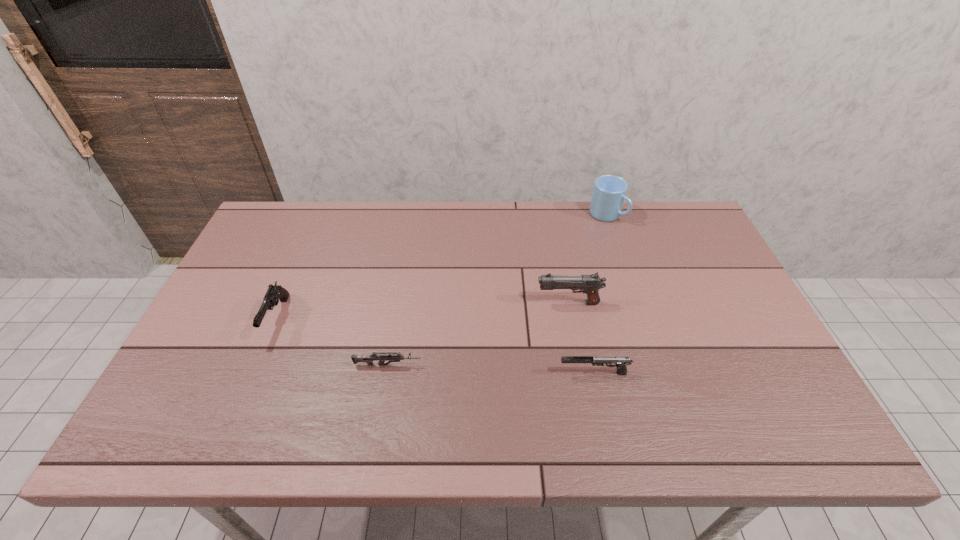
What are the coordinates of `free location located 0.060m in the direction the tallest gun is aimed` in the screenshot? It's located at (515, 303).

Where is `vacant space situated in the direction the tallest gun is aimed`? The height and width of the screenshot is (540, 960). vacant space situated in the direction the tallest gun is aimed is located at coordinates (402, 303).

Where is `blank space located in the direction the tallest gun is aimed`? This screenshot has width=960, height=540. blank space located in the direction the tallest gun is aimed is located at coordinates (489, 303).

This screenshot has height=540, width=960. What are the coordinates of `vacant point located at the end of the barrel of the leftmost object` in the screenshot? It's located at (249, 386).

Where is `free space located at the muzzle end of the fourth tallest object`? The width and height of the screenshot is (960, 540). free space located at the muzzle end of the fourth tallest object is located at coordinates (460, 373).

Locate an element on the screen. The height and width of the screenshot is (540, 960). blank space located at the muzzle end of the fourth tallest object is located at coordinates (401, 373).

Identify the location of free space located at the muzzle end of the fourth tallest object. The width and height of the screenshot is (960, 540). (521, 373).

The height and width of the screenshot is (540, 960). Find the location of `free space located aimed along the barrel of the shortest gun`. free space located aimed along the barrel of the shortest gun is located at coordinates (568, 365).

The height and width of the screenshot is (540, 960). In order to click on object that is at the far edge in this screenshot , I will do `click(609, 193)`.

Locate an element on the screen. vacant position at the far edge of the desktop is located at coordinates (633, 245).